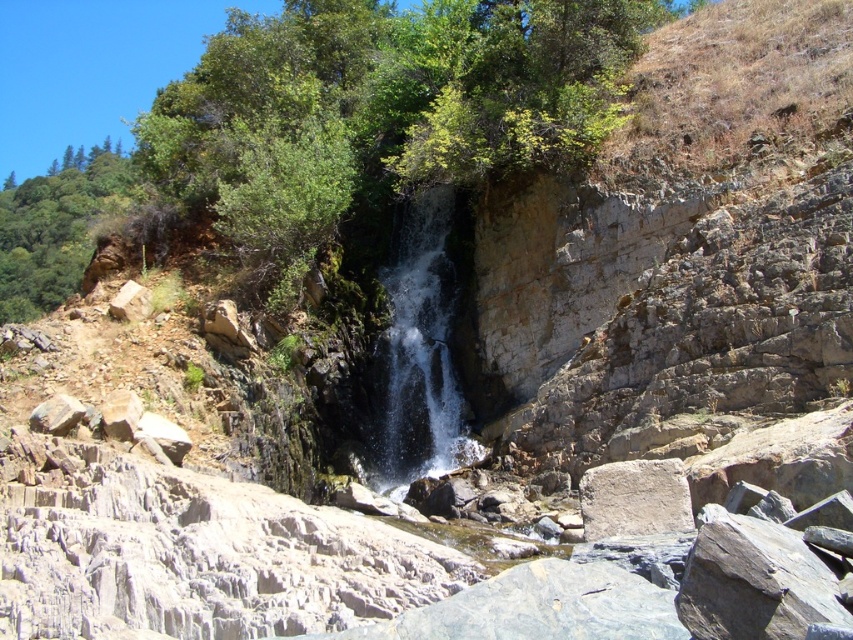
Question: Is green leafy tree at upper left further to camera compared to gray rough stone at center?

Choices:
 (A) no
 (B) yes

Answer: (B)

Question: Is green leafy tree at upper left further to camera compared to gray rough stone at center?

Choices:
 (A) yes
 (B) no

Answer: (A)

Question: Among these objects, which one is nearest to the camera?

Choices:
 (A) green leafy tree at upper left
 (B) gray rough stone at center
 (C) clear water at center

Answer: (B)

Question: Does clear water at center appear under green leafy tree at upper left?

Choices:
 (A) no
 (B) yes

Answer: (B)

Question: Which object appears farthest from the camera in this image?

Choices:
 (A) gray rough stone at center
 (B) green leafy tree at upper left
 (C) clear water at center

Answer: (B)

Question: Estimate the real-world distances between objects in this image. Which object is closer to the clear water at center?

Choices:
 (A) green leafy tree at upper left
 (B) gray rough stone at center

Answer: (B)